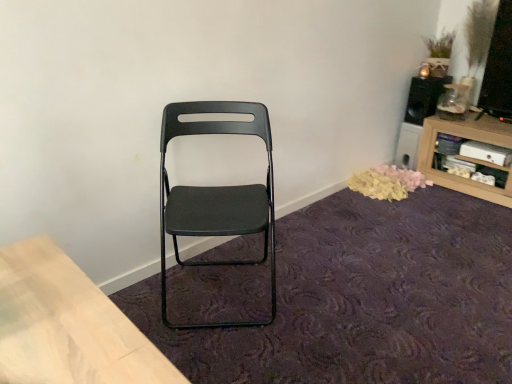
Locate an element on the screen. free area below matte black folding chair at center (from a real-world perspective) is located at coordinates (218, 294).